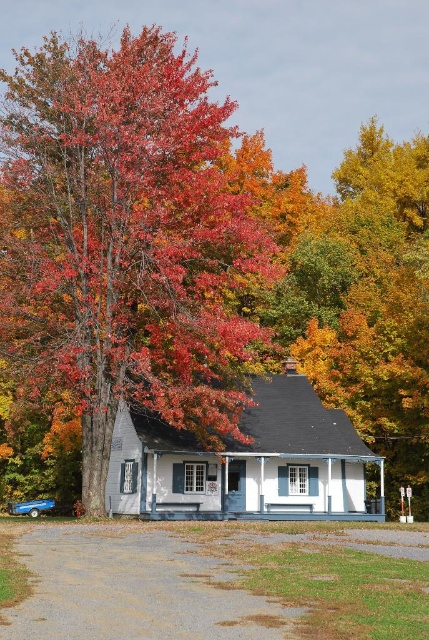
Is point (210, 314) less distant than point (322, 600)?

No, it is not.

In the scene shown: Who is lower down, shiny red leaves at left or gray gravel driveway at lower center?

gray gravel driveway at lower center is lower down.

What do you see at coordinates (126, 240) in the screenshot? The width and height of the screenshot is (429, 640). I see `shiny red leaves at left` at bounding box center [126, 240].

The height and width of the screenshot is (640, 429). What are the coordinates of `shiny red leaves at left` in the screenshot? It's located at (126, 240).